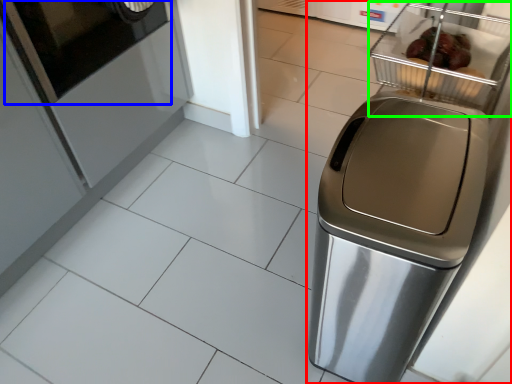
Question: Considering the real-world distances, which object is farthest from home appliance (highlighted by a red box)? screen door (highlighted by a blue box) or basket (highlighted by a green box)?

Choices:
 (A) screen door
 (B) basket

Answer: (A)